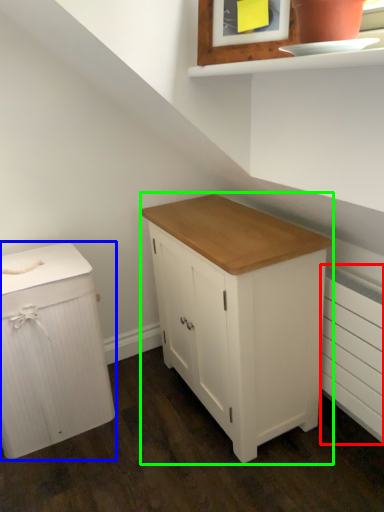
Question: Which object is the farthest from radiator (highlighted by a red box)? Choose among these: chest of drawers (highlighted by a blue box) or chest of drawers (highlighted by a green box).

Choices:
 (A) chest of drawers
 (B) chest of drawers

Answer: (A)